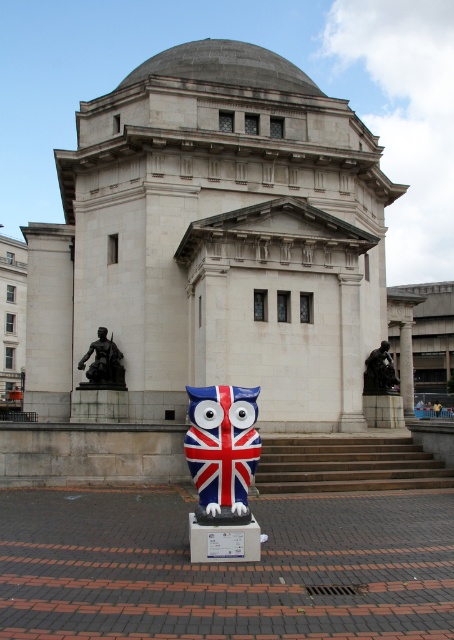
You are a tourist visiting the neoclassical building with a dome. You see the union jack painted owl at center and the bronze statue at center. Which one is closer to you?

The union jack painted owl at center is closer to you because it is in front of the bronze statue at center.

You are an art curator planning to place a new sculpture between the black polished statue at left and the smooth stone statue at right. The new sculpture is 1.2 meters wide. Can you fit it between them without moving the existing statues?

The black polished statue at left has a lesser width compared to smooth stone statue at right. Since the black polished statue at left is narrower, the space between them might accommodate the new sculpture. However, without knowing the exact distance between the statues, it is impossible to confirm if the 1.2 meters wide sculpture will fit.

You are an art student visiting the building and see both the black polished statue at left and the smooth stone statue at right. Which statue is positioned more to the east side of the building?

The black polished statue at left is positioned to the left of the smooth stone statue at right, so it is more to the east side of the building.